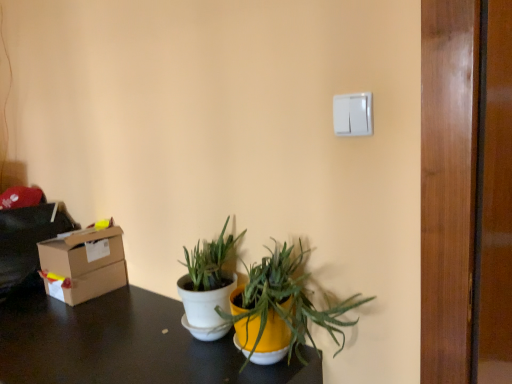
Find the location of a particular element. This screenshot has height=384, width=512. vacant space underneath white matte pot at center, arranged as the 1th houseplant when viewed from the right (from a real-world perspective) is located at coordinates (262, 366).